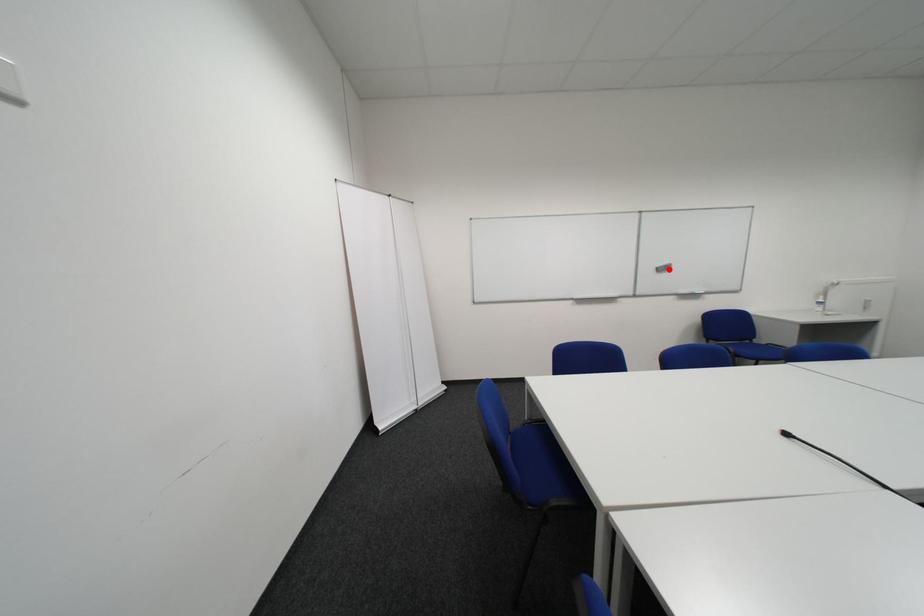
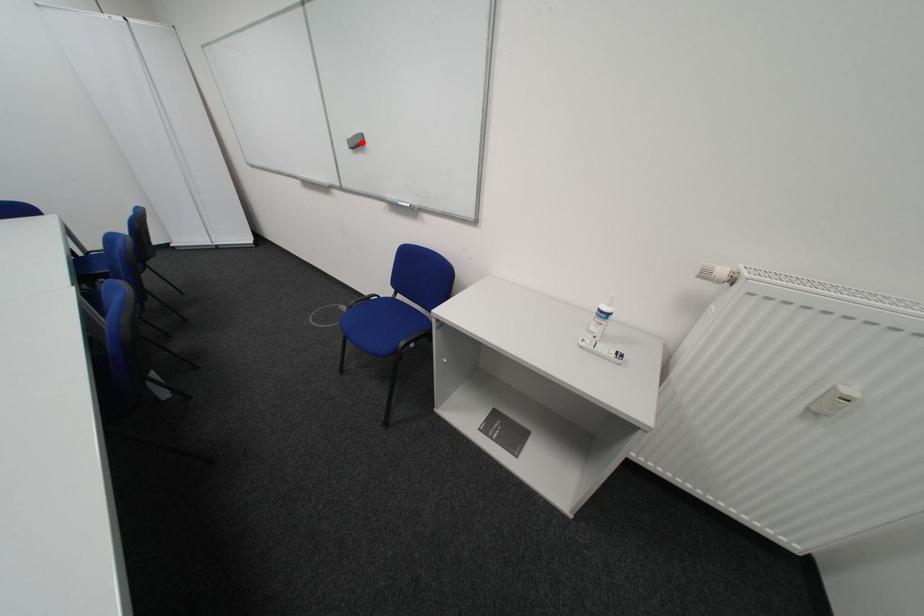
I am providing you with two images of the same scene from different viewpoints. A red point is marked on the first image and another point is marked on the second image. Do the highlighted points in image1 and image2 indicate the same real-world spot?

Yes